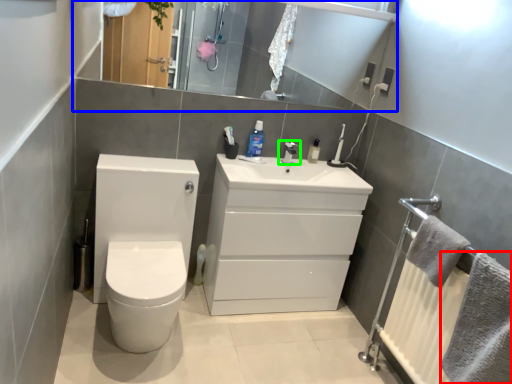
Question: Considering the real-world distances, which object is farthest from bath towel (highlighted by a red box)? mirror (highlighted by a blue box) or tap (highlighted by a green box)?

Choices:
 (A) mirror
 (B) tap

Answer: (A)